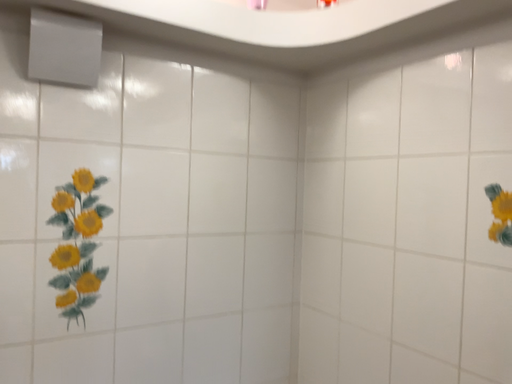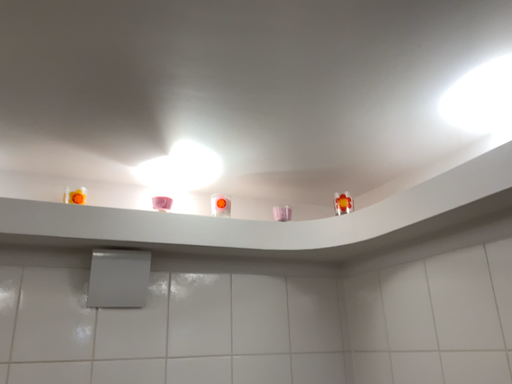
Question: Which way did the camera rotate in the video?

Choices:
 (A) rotated right
 (B) rotated left

Answer: (B)